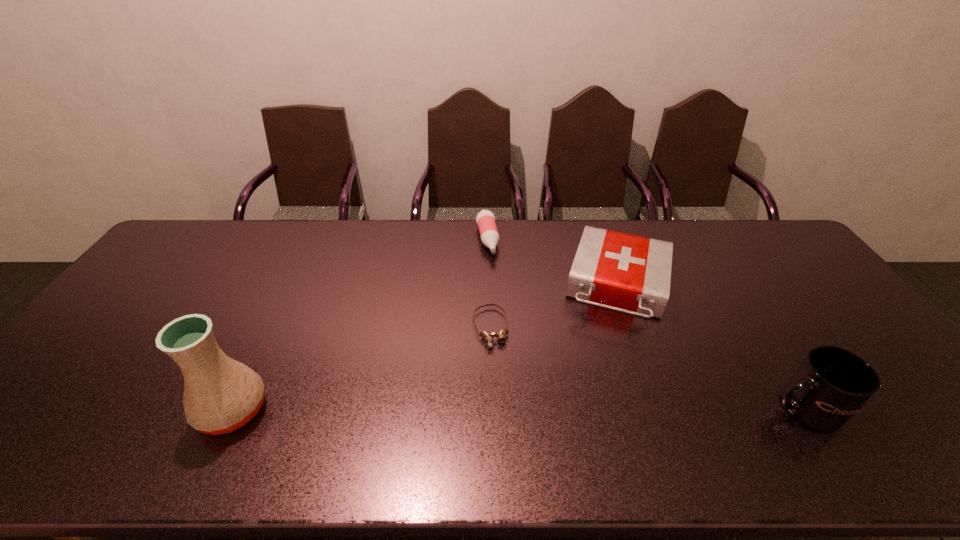
I want to click on vacant region located with the handle on the side of the fourth shortest object, so click(627, 408).

I want to click on free region located with the handle on the side of the fourth shortest object, so click(x=715, y=408).

Identify the location of vacant position located on the front side of the third tallest object. (596, 422).

Identify the location of free region located 0.180m on the front side of the third tallest object. (604, 382).

At what (x,y) coordinates should I click in order to perform the action: click on free location located 0.160m on the front side of the third tallest object. Please return your answer as a coordinate pair (x, y). Looking at the image, I should click on (605, 376).

Locate an element on the screen. This screenshot has height=540, width=960. vacant space situated 0.160m with the cap open on the second shortest object is located at coordinates (497, 294).

The height and width of the screenshot is (540, 960). In order to click on free point located with the cap open on the second shortest object in this screenshot , I will do `click(507, 339)`.

Identify the location of free space located 0.210m with the cap open on the second shortest object. (499, 306).

Image resolution: width=960 pixels, height=540 pixels. Find the location of `free region located on the front lenses and sides of the shortest object`. free region located on the front lenses and sides of the shortest object is located at coordinates (500, 375).

Locate an element on the screen. The image size is (960, 540). free space located on the front lenses and sides of the shortest object is located at coordinates tap(509, 413).